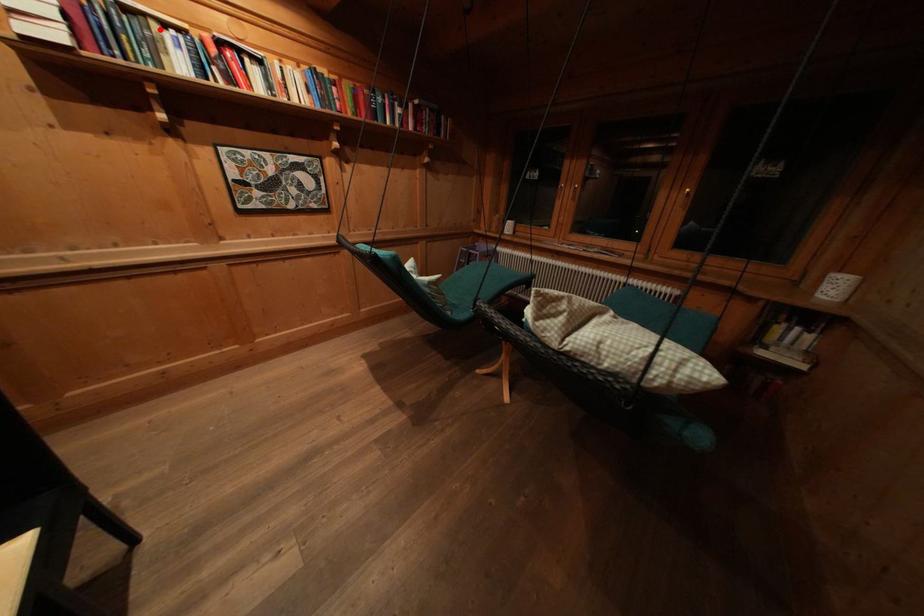
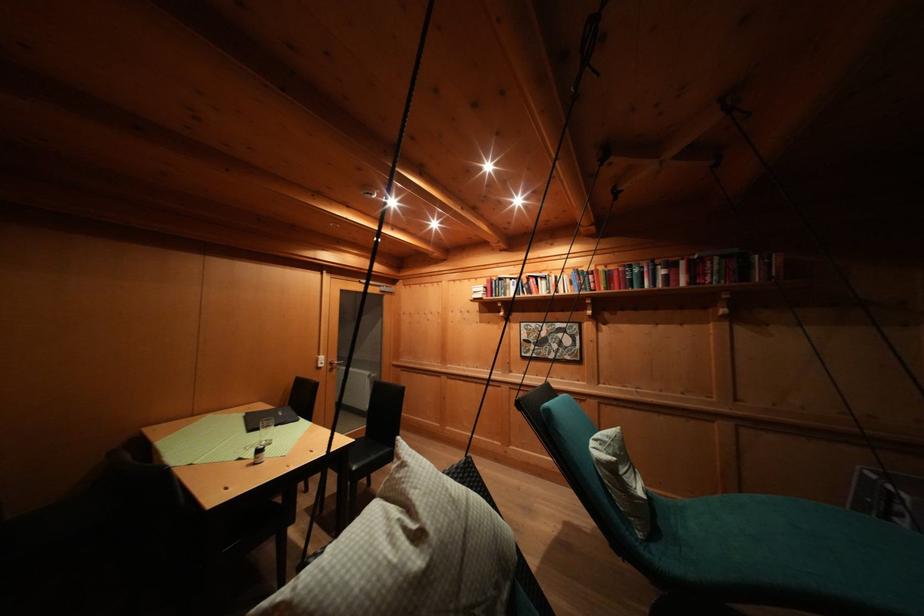
Question: I am providing you with two images of the same scene from different viewpoints. Image1 has a red point marked. In image2, the corresponding 3D location appears at what relative position? Reply with the corresponding letter.

Choices:
 (A) Closer
 (B) Farther

Answer: (A)